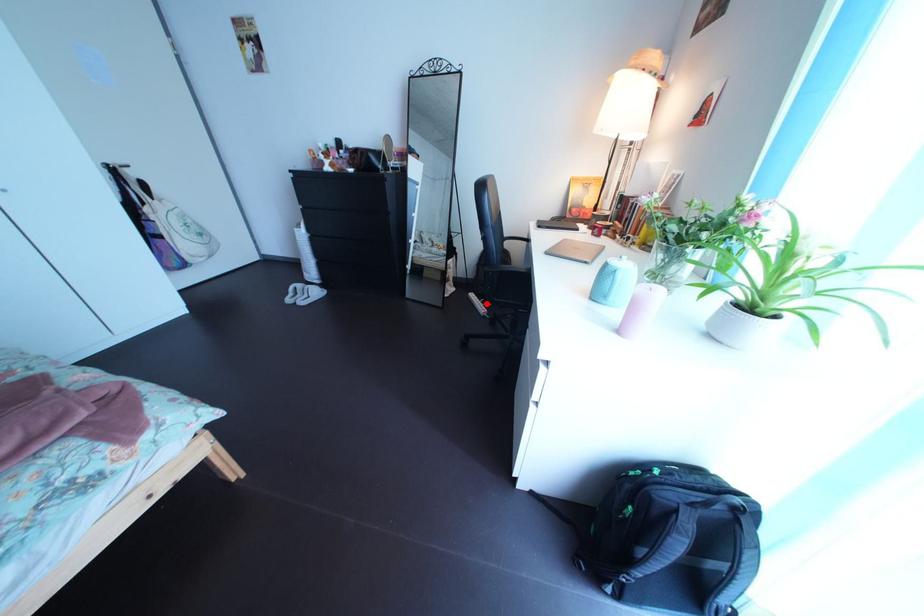
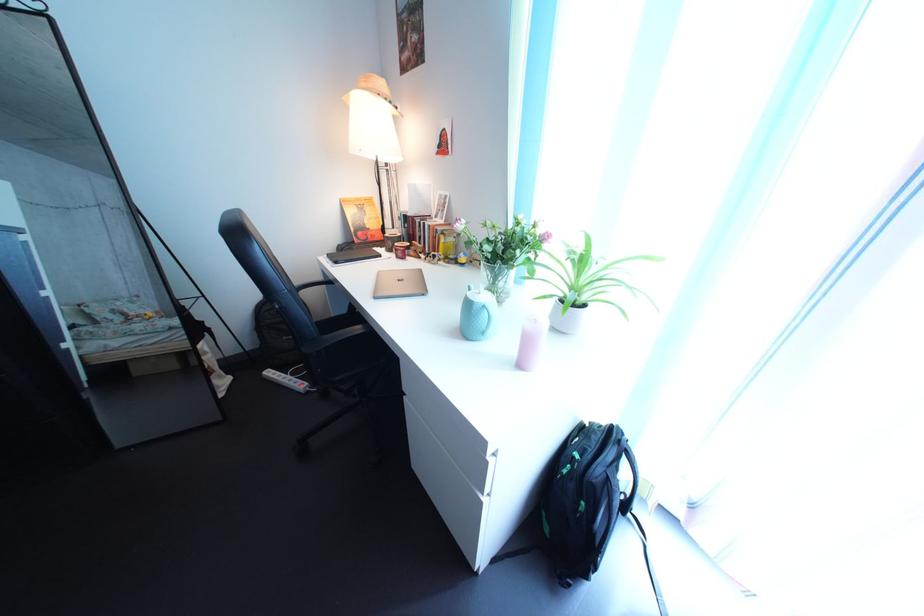
Find the pixel in the second image that matches the highlighted location in the first image.

(284, 381)